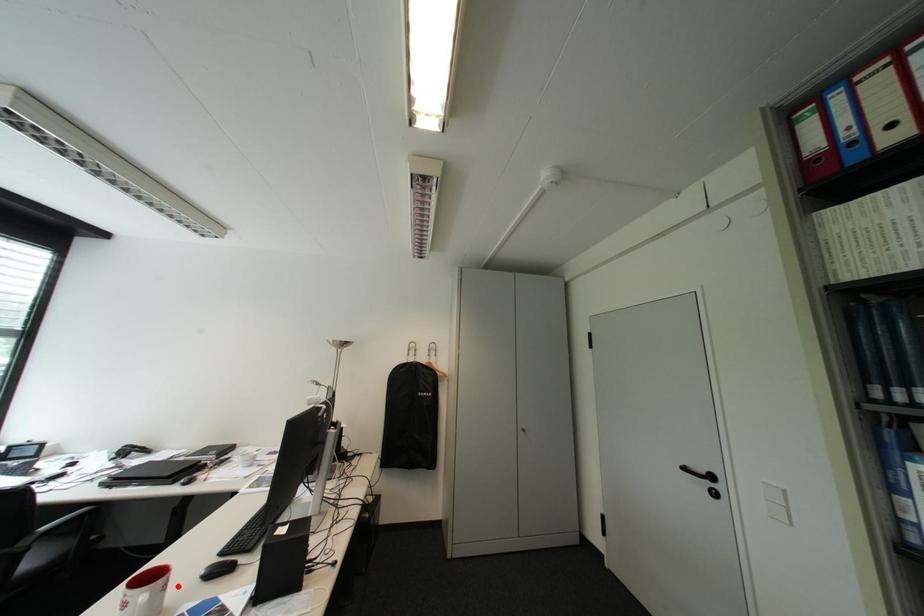
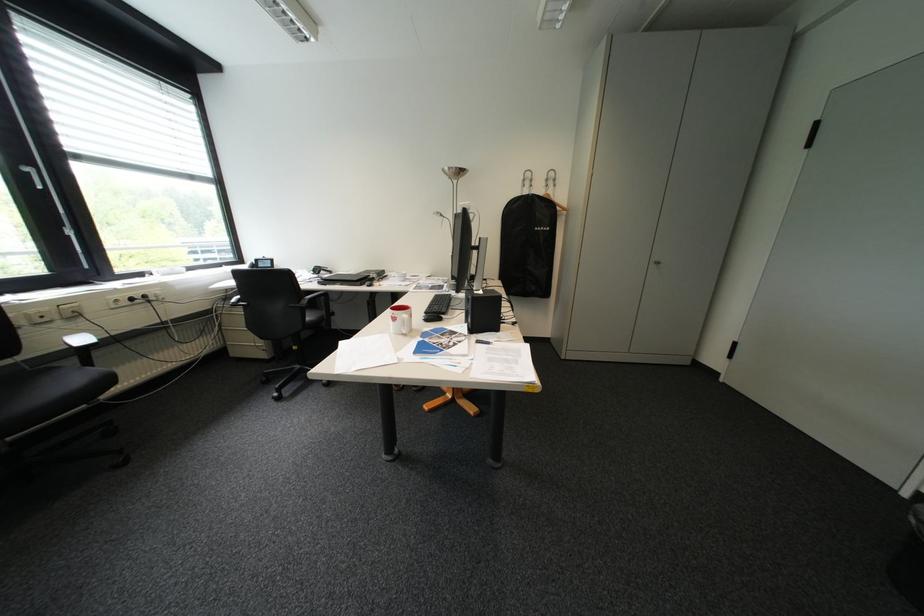
The point at the highlighted location is marked in the first image. Where is the corresponding point in the second image?

(423, 315)